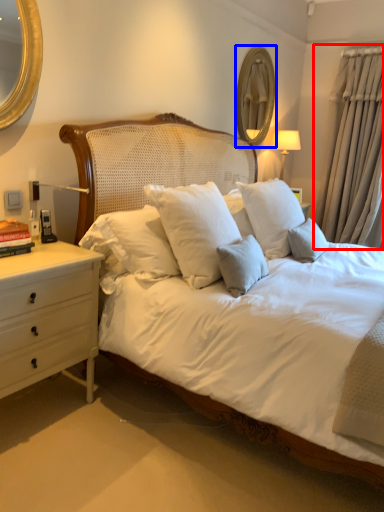
Question: Which object is closer to the camera taking this photo, curtain (highlighted by a red box) or mirror (highlighted by a blue box)?

Choices:
 (A) curtain
 (B) mirror

Answer: (B)